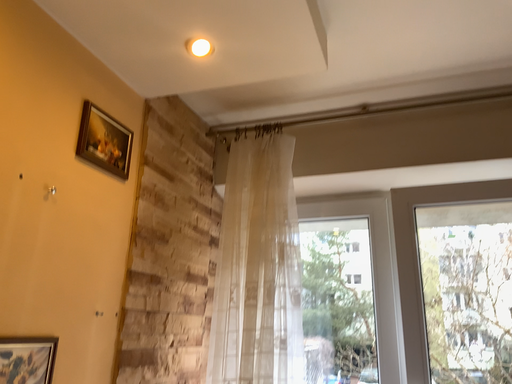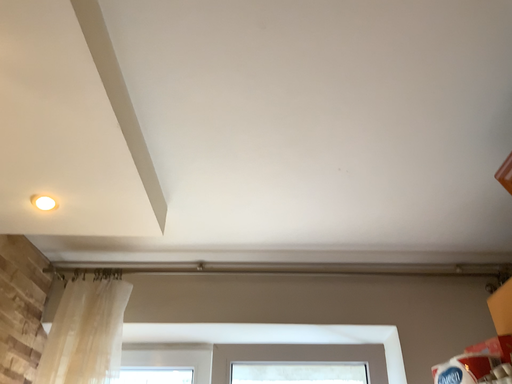
Question: Which way did the camera rotate in the video?

Choices:
 (A) rotated left
 (B) rotated right

Answer: (B)